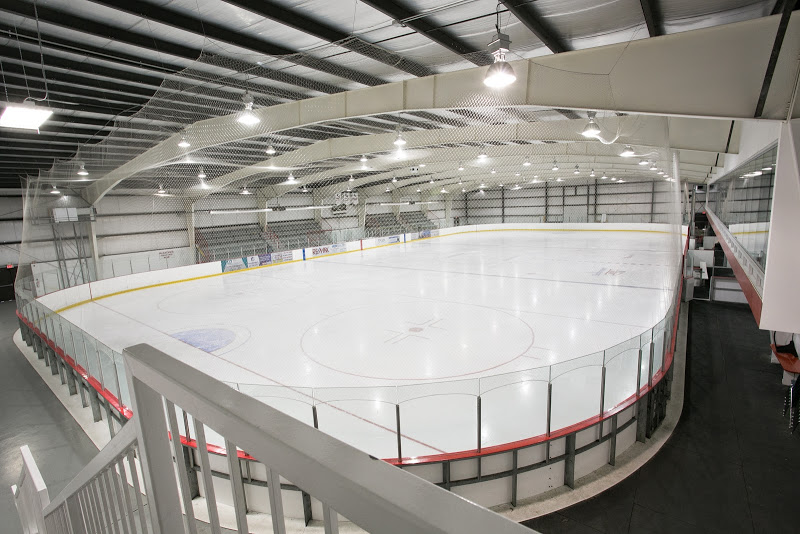
Locate an element on the screen. The width and height of the screenshot is (800, 534). glass window is located at coordinates (757, 214).